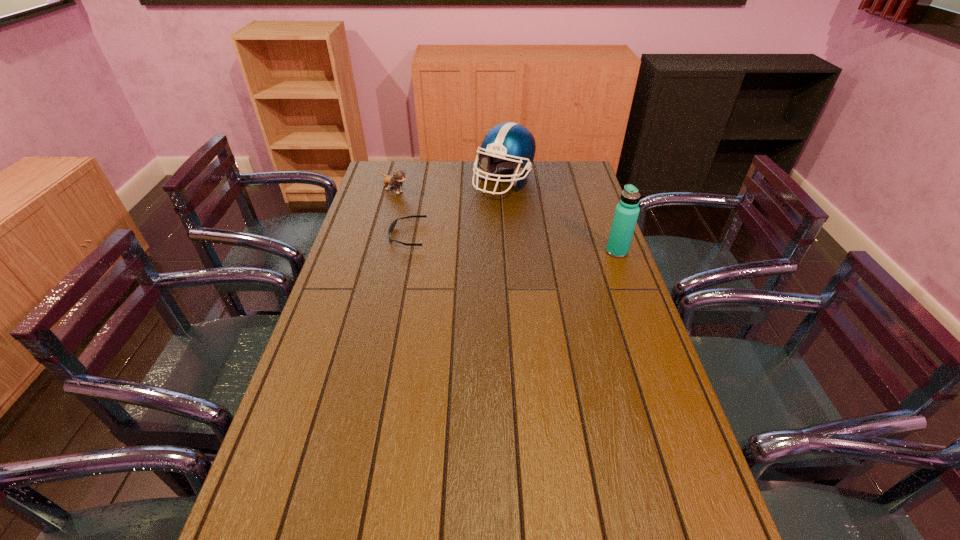
Where is `vacant space on the desktop that is between the sunglasses and the rightmost object and is positioned on the front-facing side of the third tallest object`? This screenshot has width=960, height=540. vacant space on the desktop that is between the sunglasses and the rightmost object and is positioned on the front-facing side of the third tallest object is located at coordinates (511, 244).

You are a GUI agent. You are given a task and a screenshot of the screen. Output one action in this format:
    pyautogui.click(x=<x>, y=<y>)
    Task: Click on the vacant space on the desktop that is between the shortest object and the water bottle and is positioned at the front of the second object from right to left with the faceguard
    The height and width of the screenshot is (540, 960).
    Given the screenshot: What is the action you would take?
    pyautogui.click(x=530, y=245)